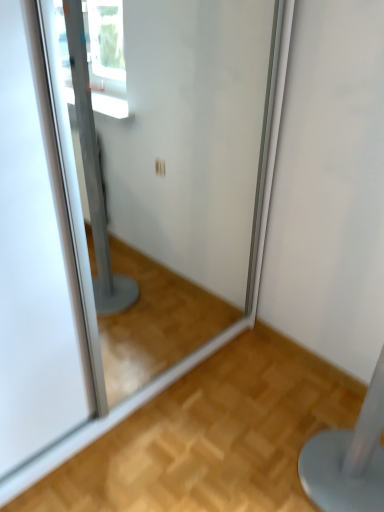
What do you see at coordinates (163, 169) in the screenshot? The image size is (384, 512). I see `clear glass mirror at center` at bounding box center [163, 169].

Find the location of a particular element. This screenshot has width=384, height=512. clear glass mirror at center is located at coordinates (163, 169).

Locate an element on the screen. The image size is (384, 512). clear glass mirror at center is located at coordinates (163, 169).